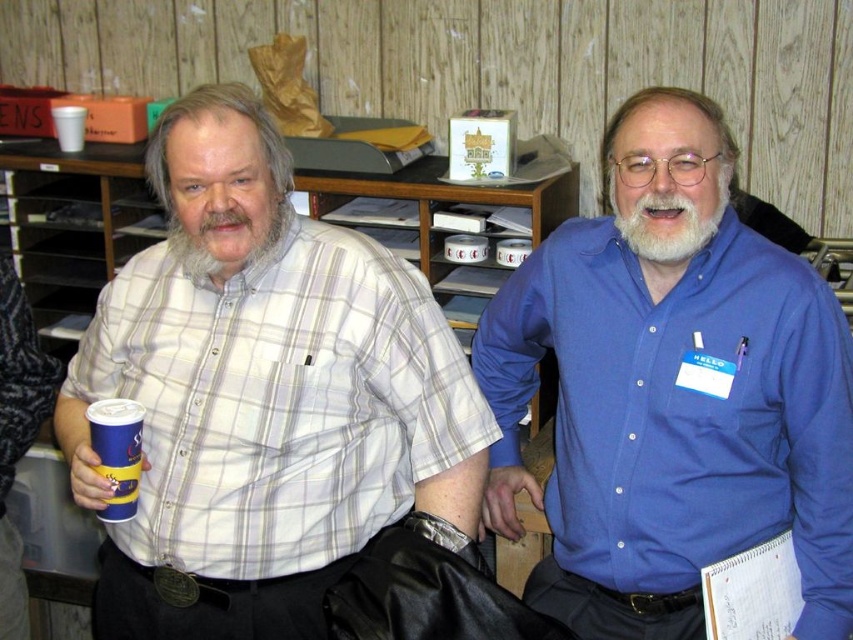
You are a photographer planning to take a group photo of the grayhairbeard at center and the whitehairbeard at center. To ensure both are in focus, you need to position them so that their heights are balanced. Which person should stand on a small platform to achieve this?

The grayhairbeard at center has a greater height compared to whitehairbeard at center, so the whitehairbeard at center should stand on a small platform to balance their heights.